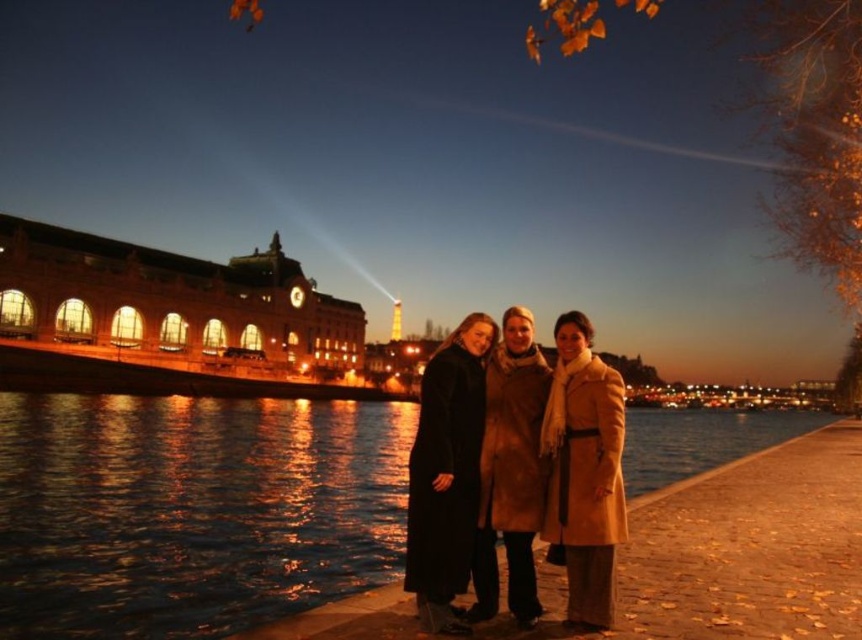
You are trying to locate the beige wool coat at center in the evening scene. From the perspective of someone standing at the edge of the walkway facing the water, which direction should you look to find the matte brown coat at center?

The matte brown coat at center is to the left of the beige wool coat at center, so you should look to your left to find it.

You are standing at the point marked by coordinates point (x=560, y=474) in the image. Looking around, you see three people nearby. Which person is exactly at your current location?

The person wearing the matte brown coat at center is exactly at the point marked by coordinates point (x=560, y=474).

You are standing on the paved walkway and want to take a photo of the blue water at center. Where should you aim your camera to capture it?

You should aim your camera at point (191, 512) to capture the blue water at center.